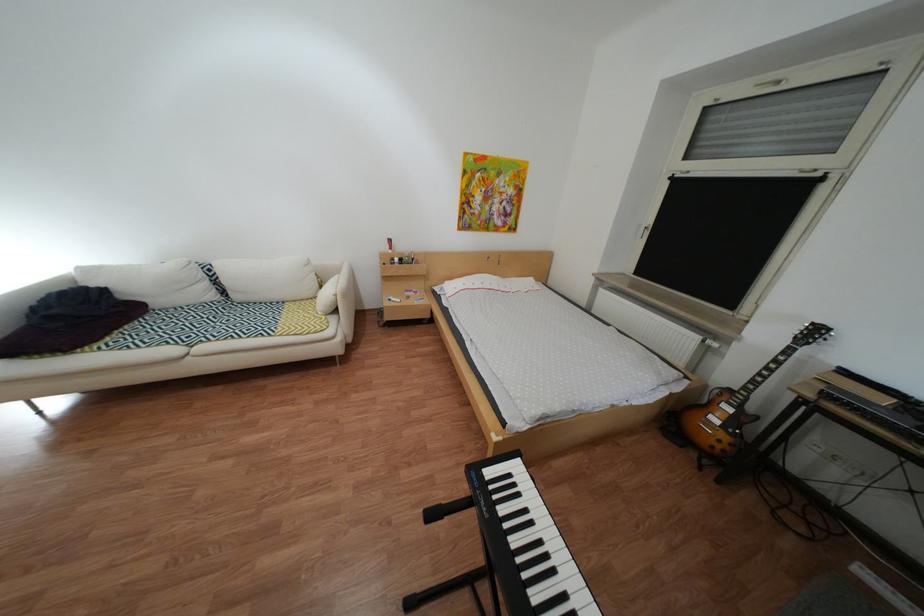
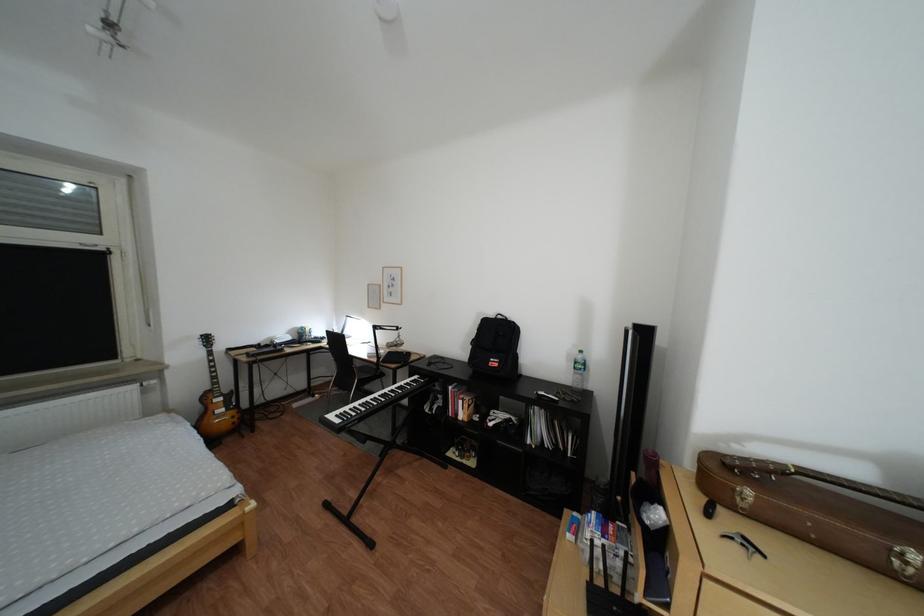
Question: I am providing you with two images of the same scene from different viewpoints. After the viewpoint changes to image2, which objects are now occluded?

Choices:
 (A) chair sitting surface
 (B) electric guitar
 (C) keyboard keys
 (D) none of these

Answer: (D)